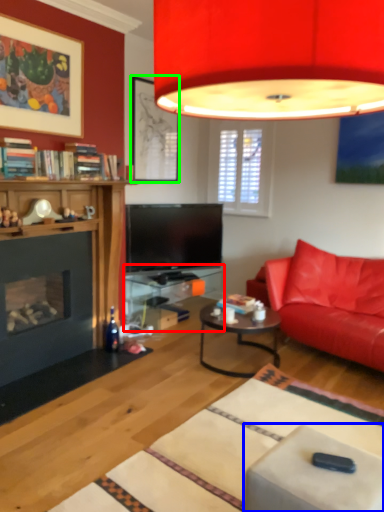
Question: Which object is positioned closest to table (highlighted by a red box)? Select from swivel chair (highlighted by a blue box) and picture frame (highlighted by a green box).

Choices:
 (A) swivel chair
 (B) picture frame

Answer: (B)